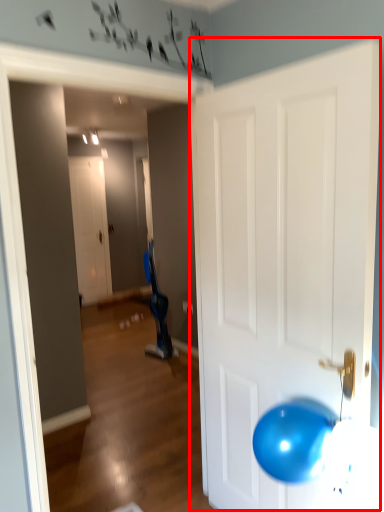
Question: In this image, where is door (annotated by the red box) located relative to door?

Choices:
 (A) right
 (B) left

Answer: (A)